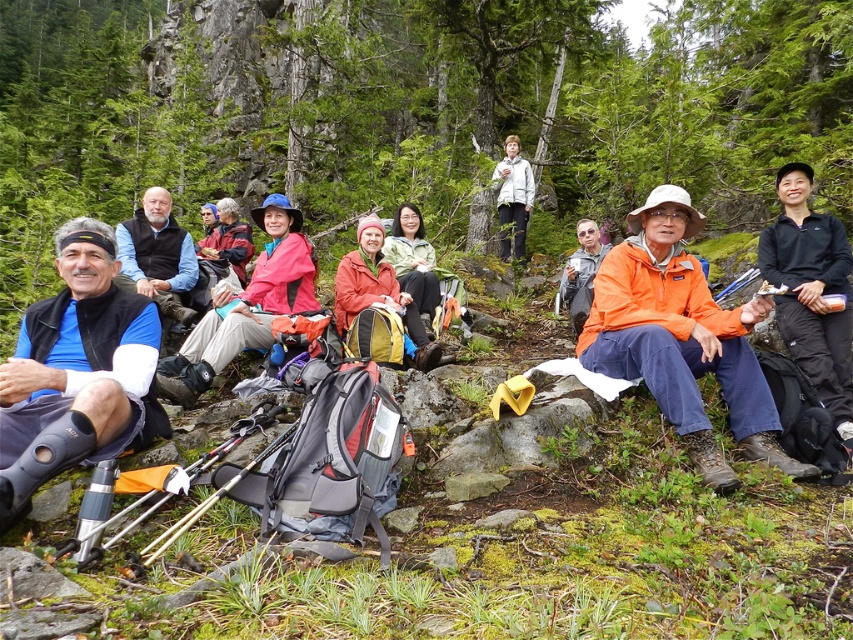
You are a hiker trying to locate your friend who is wearing a matte pink jacket at center and another friend wearing a matte orange jacket at center. Which jacket is closer to you?

The matte pink jacket at center is closer to the viewer than the matte orange jacket at center, so the matte pink jacket at center is closer to you.

You are a hiker who wants to know which jacket has a larger size between the matte pink jacket at center and the light gray jacket at center. Based on the scene, which one is wider?

The matte pink jacket at center is wider than the light gray jacket at center as its width surpasses the latter.

You are a hiker standing at the point with coordinates point (428,346) and want to move towards the rocky cliff face in the background. Is the point point (498,212) located behind you or in front of you?

Point (428,346) is in front of point (498,212), so if you are standing at point (428,346) facing towards the rocky cliff face, the point (498,212) would be behind you.